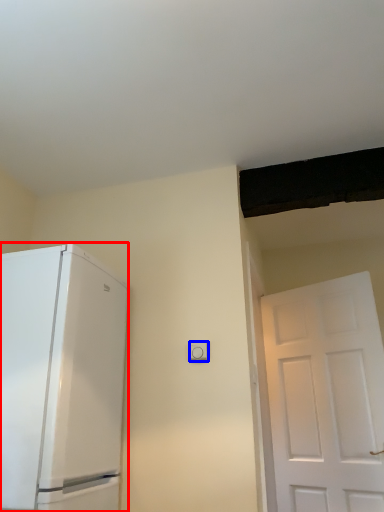
Question: Which point is closer to the camera, refrigerator (highlighted by a red box) or light switch (highlighted by a blue box)?

Choices:
 (A) refrigerator
 (B) light switch

Answer: (A)